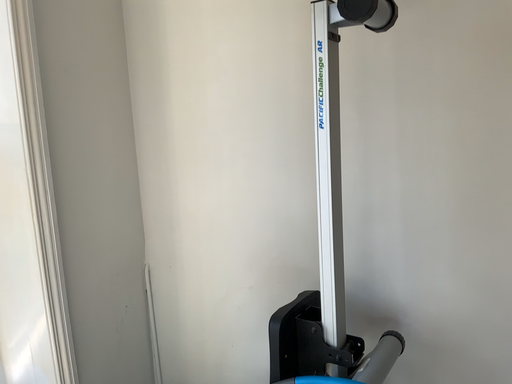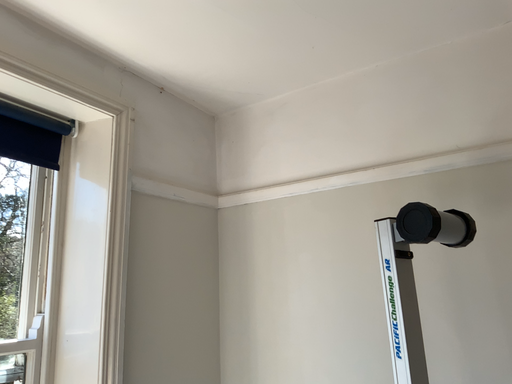
Question: How did the camera likely rotate when shooting the video?

Choices:
 (A) rotated right
 (B) rotated left

Answer: (B)